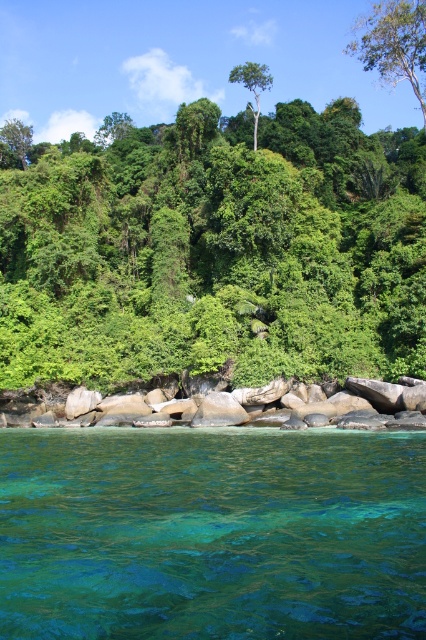
Consider the image. Who is taller, smooth gray rocks at lower center or green leafy tree at upper left?

green leafy tree at upper left

Is point (347, 388) more distant than point (17, 144)?

That is False.

What do you see at coordinates (77, 406) in the screenshot? I see `smooth gray rocks at lower center` at bounding box center [77, 406].

Find the location of a particular element. smooth gray rocks at lower center is located at coordinates (77, 406).

Is teal translucent water at lower center above green leafy tree at upper center?

Actually, teal translucent water at lower center is below green leafy tree at upper center.

Which is below, teal translucent water at lower center or green leafy tree at upper center?

Positioned lower is teal translucent water at lower center.

Find the location of `teal translucent water at lower center`. teal translucent water at lower center is located at coordinates (212, 532).

Where is `teal translucent water at lower center`? The width and height of the screenshot is (426, 640). teal translucent water at lower center is located at coordinates (212, 532).

Locate an element on the screen. The image size is (426, 640). green leafy tree at center is located at coordinates (216, 252).

Image resolution: width=426 pixels, height=640 pixels. I want to click on green leafy tree at center, so click(x=216, y=252).

This screenshot has height=640, width=426. I want to click on green leafy tree at center, so click(x=216, y=252).